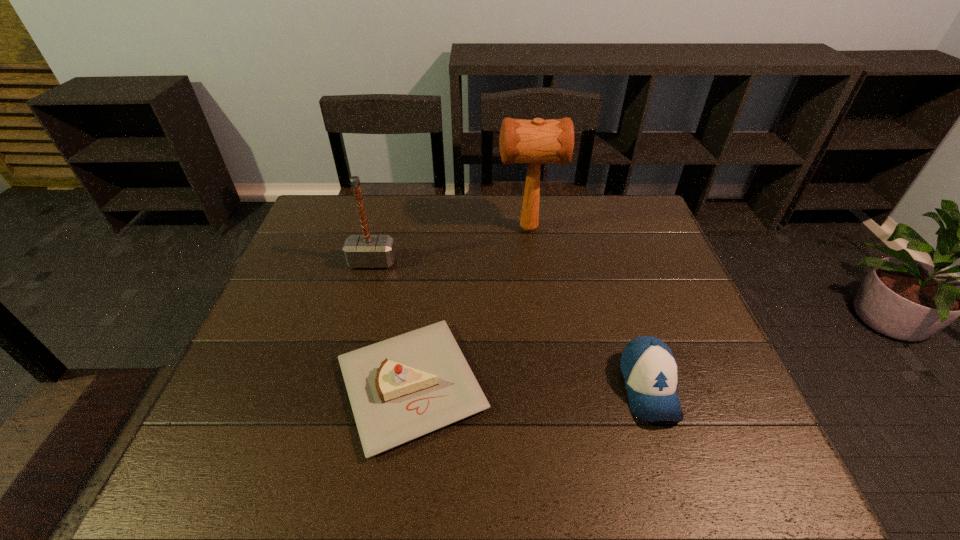
Identify which object is the second closest to the farthest object. Please provide its 2D coordinates. Your answer should be formatted as a tuple, i.e. [(x, y)], where the tuple contains the x and y coordinates of a point satisfying the conditions above.

[(402, 388)]

Where is `object that is the closest to the hammer`? object that is the closest to the hammer is located at coordinates (402, 388).

Identify the location of vacant space that satisfies the following two spatial constraints: 1. on the strike surface of the tallest object; 2. on the striking surface of the second farthest object. Image resolution: width=960 pixels, height=540 pixels. (533, 262).

Find the location of a particular element. vacant space that satisfies the following two spatial constraints: 1. on the striking surface of the second tallest object; 2. on the left side of the cake is located at coordinates [x=339, y=386].